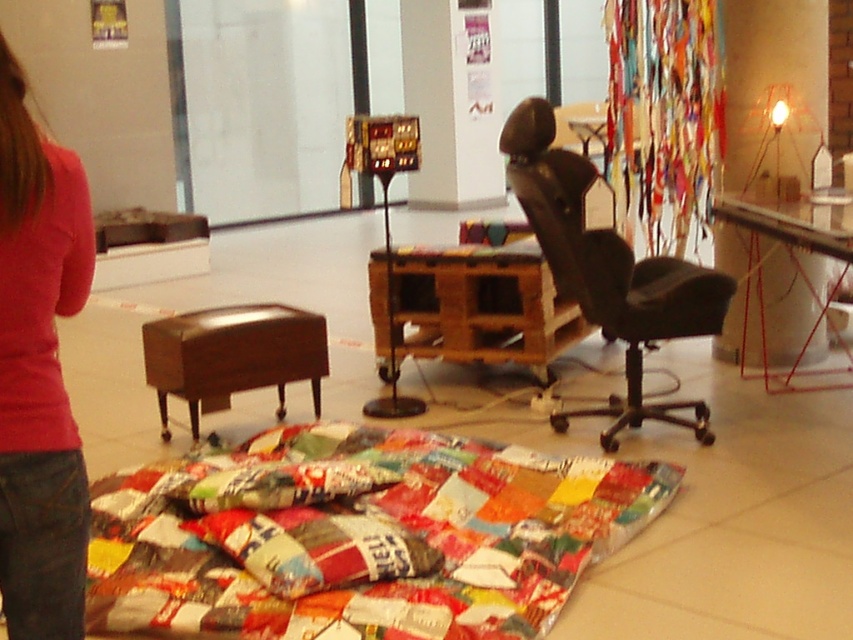
Based on the photo, can you confirm if pink fabric at lower left is bigger than black leather swivel chair at center right?

Incorrect, pink fabric at lower left is not larger than black leather swivel chair at center right.

What do you see at coordinates (39, 371) in the screenshot? The image size is (853, 640). I see `pink fabric at lower left` at bounding box center [39, 371].

Is point (13, 340) farther from viewer compared to point (518, 198)?

No, (13, 340) is in front of (518, 198).

You are a GUI agent. You are given a task and a screenshot of the screen. Output one action in this format:
    pyautogui.click(x=<x>, y=<y>)
    Task: Click on the pink fabric at lower left
    The image size is (853, 640).
    Given the screenshot: What is the action you would take?
    pyautogui.click(x=39, y=371)

Where is `patchwork fabric at center`? Image resolution: width=853 pixels, height=640 pixels. patchwork fabric at center is located at coordinates (358, 536).

Who is more distant from viewer, (653,461) or (41,340)?

The point (653,461) is more distant.

The image size is (853, 640). Identify the location of patchwork fabric at center. (358, 536).

Is patchwork fabric at center shorter than black leather swivel chair at center right?

Yes, patchwork fabric at center is shorter than black leather swivel chair at center right.

Is point (225, 589) closer to viewer compared to point (553, 163)?

Yes, point (225, 589) is in front of point (553, 163).

At what (x,y) coordinates should I click in order to perform the action: click on patchwork fabric at center. Please return your answer as a coordinate pair (x, y). The image size is (853, 640). Looking at the image, I should click on (358, 536).

I want to click on patchwork fabric at center, so click(x=358, y=536).